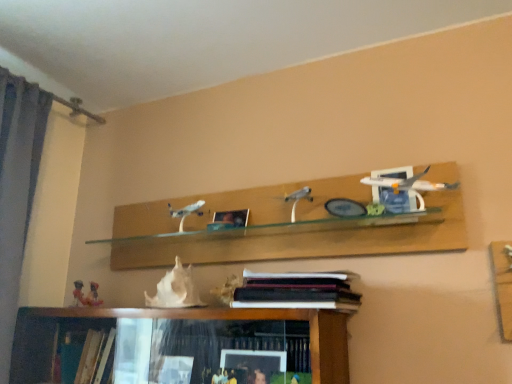
Locate an element on the screen. Image resolution: width=512 pixels, height=384 pixels. metallic silver picture frame at center is located at coordinates (230, 219).

This screenshot has width=512, height=384. Describe the element at coordinates (297, 291) in the screenshot. I see `hardcover books at center` at that location.

You are a GUI agent. You are given a task and a screenshot of the screen. Output one action in this format:
    pyautogui.click(x=<x>, y=<y>)
    Task: Click on the metallic silver picture frame at center
    
    Given the screenshot: What is the action you would take?
    pyautogui.click(x=230, y=219)

Is white glossy airplane at upper right turned away from white matte seashell at center?

No, white glossy airplane at upper right is not facing the opposite direction of white matte seashell at center.

Do you think white glossy airplane at upper right is within white matte seashell at center, or outside of it?

white glossy airplane at upper right is spatially situated outside white matte seashell at center.

Is point (391, 207) farther from viewer compared to point (172, 272)?

No.

Is white glossy airplane at upper right next to white matte seashell at center?

No.

From a real-world perspective, between white matte seashell at center and hardcover books at center, who is vertically lower?

In real-world perspective, hardcover books at center is lower.

There is a hardcover books at center. Where is `animal above it (from a real-world perspective)`? animal above it (from a real-world perspective) is located at coordinates (175, 289).

Is point (178, 298) closer to camera compared to point (289, 296)?

That is False.

Would you say white matte seashell at center is to the left or to the right of hardcover books at center in the picture?

From the image, it's evident that white matte seashell at center is to the left of hardcover books at center.

Where is `picture frame that is behind the white matte seashell at center`? picture frame that is behind the white matte seashell at center is located at coordinates (230, 219).

From a real-world perspective, is white matte seashell at center located beneath metallic silver picture frame at center?

Yes, from a real-world perspective, white matte seashell at center is under metallic silver picture frame at center.

From the image's perspective, would you say white matte seashell at center is positioned over metallic silver picture frame at center?

Incorrect, from the image's perspective, white matte seashell at center is lower than metallic silver picture frame at center.

Is point (189, 281) behind point (239, 221)?

No.

From a real-world perspective, which object rests below the other?

hardcover books at center.

From the image's perspective, relative to hardcover books at center, is white glossy airplane at upper right above or below?

white glossy airplane at upper right is above hardcover books at center.

Is point (437, 185) closer or farther from the camera than point (328, 304)?

Point (437, 185) is farther from the camera than point (328, 304).

At what (x,y) coordinates should I click in order to perform the action: click on book in front of the metallic silver picture frame at center. Please return your answer as a coordinate pair (x, y). Image resolution: width=512 pixels, height=384 pixels. Looking at the image, I should click on (297, 291).

Considering the positions of objects hardcover books at center and metallic silver picture frame at center in the image provided, who is more to the right, hardcover books at center or metallic silver picture frame at center?

Positioned to the right is hardcover books at center.

Considering their positions, is hardcover books at center located in front of or behind metallic silver picture frame at center?

In the image, hardcover books at center appears in front of metallic silver picture frame at center.

From the image's perspective, is hardcover books at center located above metallic silver picture frame at center?

Incorrect, from the image's perspective, hardcover books at center is lower than metallic silver picture frame at center.

Is hardcover books at center far away from white glossy airplane at upper right?

That's not correct — hardcover books at center is a little close to white glossy airplane at upper right.

From their relative heights in the image, would you say hardcover books at center is taller or shorter than white glossy airplane at upper right?

hardcover books at center is shorter than white glossy airplane at upper right.

Can you confirm if hardcover books at center is thinner than white glossy airplane at upper right?

No, hardcover books at center is not thinner than white glossy airplane at upper right.

From a real-world perspective, is hardcover books at center located higher than white glossy airplane at upper right?

Actually, hardcover books at center is physically below white glossy airplane at upper right in the real world.

Which is more to the left, metallic silver picture frame at center or white glossy airplane at upper right?

From the viewer's perspective, metallic silver picture frame at center appears more on the left side.

Does point (242, 211) appear closer or farther from the camera than point (392, 187)?

Point (242, 211) is positioned farther from the camera compared to point (392, 187).

Is metallic silver picture frame at center positioned before white glossy airplane at upper right?

No, metallic silver picture frame at center is further to the viewer.

Find the location of a particular element. animal located below the white glossy airplane at upper right (from the image's perspective) is located at coordinates (175, 289).

You are a GUI agent. You are given a task and a screenshot of the screen. Output one action in this format:
    pyautogui.click(x=<x>, y=<y>)
    Task: Click on the animal above the hardcover books at center (from the image's perspective)
    The width and height of the screenshot is (512, 384).
    Given the screenshot: What is the action you would take?
    pyautogui.click(x=175, y=289)

Which object lies further to the anchor point white glossy airplane at upper right, metallic silver picture frame at center or hardcover books at center?

metallic silver picture frame at center.

When comparing their distances from white glossy airplane at upper right, does white matte seashell at center or hardcover books at center seem closer?

Among the two, hardcover books at center is located nearer to white glossy airplane at upper right.

Considering their positions, is white matte seashell at center positioned further to metallic silver picture frame at center than white glossy airplane at upper right?

Based on the image, white glossy airplane at upper right appears to be further to metallic silver picture frame at center.

In the scene shown: From the image, which object appears to be nearer to hardcover books at center, white matte seashell at center or white glossy airplane at upper right?

The object closer to hardcover books at center is white matte seashell at center.

Estimate the real-world distances between objects in this image. Which object is closer to white glossy airplane at upper right, hardcover books at center or metallic silver picture frame at center?

The object closer to white glossy airplane at upper right is hardcover books at center.

Looking at the image, which one is located closer to hardcover books at center, white glossy airplane at upper right or metallic silver picture frame at center?

white glossy airplane at upper right.

Considering their positions, is metallic silver picture frame at center positioned closer to white matte seashell at center than white glossy airplane at upper right?

metallic silver picture frame at center is closer to white matte seashell at center.

Which object lies nearer to the anchor point white matte seashell at center, hardcover books at center or metallic silver picture frame at center?

metallic silver picture frame at center is positioned closer to the anchor white matte seashell at center.

Where is `book located between white matte seashell at center and white glossy airplane at upper right in the left-right direction`? Image resolution: width=512 pixels, height=384 pixels. book located between white matte seashell at center and white glossy airplane at upper right in the left-right direction is located at coordinates (297, 291).

You are a GUI agent. You are given a task and a screenshot of the screen. Output one action in this format:
    pyautogui.click(x=<x>, y=<y>)
    Task: Click on the picture frame between white matte seashell at center and white glossy airplane at upper right in the horizontal direction
    The image size is (512, 384).
    Given the screenshot: What is the action you would take?
    pyautogui.click(x=230, y=219)

Where is `animal located between hardcover books at center and metallic silver picture frame at center in the depth direction`? The image size is (512, 384). animal located between hardcover books at center and metallic silver picture frame at center in the depth direction is located at coordinates (175, 289).

The height and width of the screenshot is (384, 512). Find the location of `book between white glossy airplane at upper right and metallic silver picture frame at center from front to back`. book between white glossy airplane at upper right and metallic silver picture frame at center from front to back is located at coordinates (297, 291).